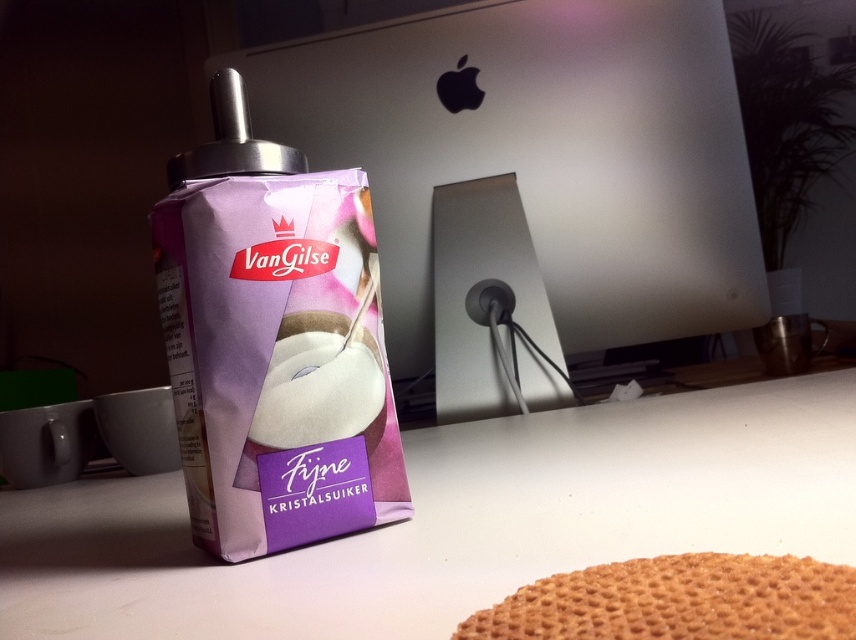
Between point (617, 420) and point (706, 632), which one is positioned behind?

Point (617, 420)

Does white matte table at center appear under golden textured wafer at lower right?

Correct, white matte table at center is located below golden textured wafer at lower right.

The image size is (856, 640). What do you see at coordinates (453, 522) in the screenshot?
I see `white matte table at center` at bounding box center [453, 522].

At what (x,y) coordinates should I click in order to perform the action: click on white matte table at center. Please return your answer as a coordinate pair (x, y). Image resolution: width=856 pixels, height=640 pixels. Looking at the image, I should click on (453, 522).